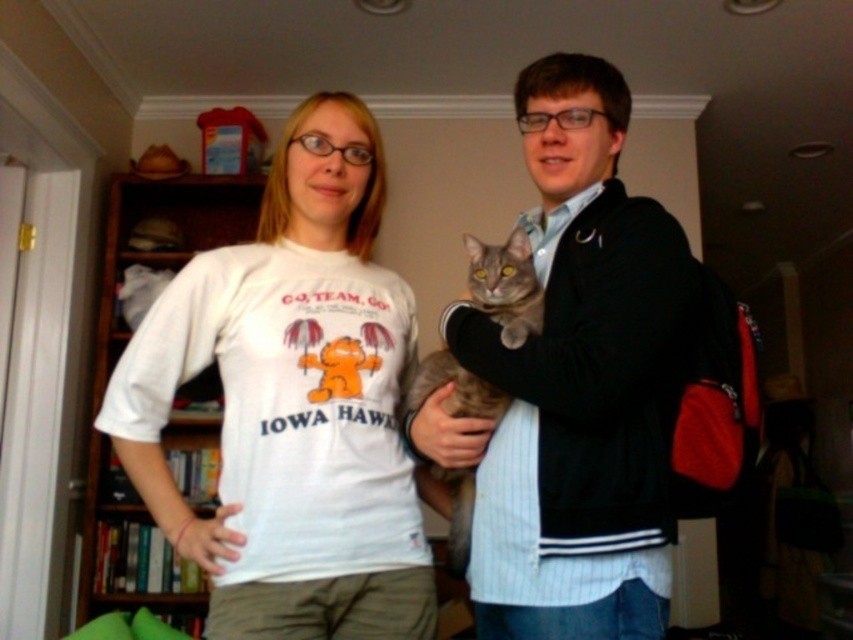
Question: Does gray fur cat at center appear on the right side of wooden bookshelf at left?

Choices:
 (A) no
 (B) yes

Answer: (B)

Question: Which of the following is the farthest from the observer?

Choices:
 (A) gray tabby cat at center
 (B) wooden bookshelf at left
 (C) white cotton t-shirt at center
 (D) gray fur cat at center

Answer: (B)

Question: Does white cotton t-shirt at center have a smaller size compared to gray fur cat at center?

Choices:
 (A) no
 (B) yes

Answer: (A)

Question: Which point is closer to the camera?

Choices:
 (A) wooden bookshelf at left
 (B) gray fur cat at center

Answer: (B)

Question: Which of the following is the farthest from the observer?

Choices:
 (A) tap(463, 545)
 (B) tap(119, 176)
 (C) tap(271, 200)

Answer: (B)

Question: From the image, what is the correct spatial relationship of wooden bookshelf at left in relation to gray tabby cat at center?

Choices:
 (A) above
 (B) below

Answer: (B)